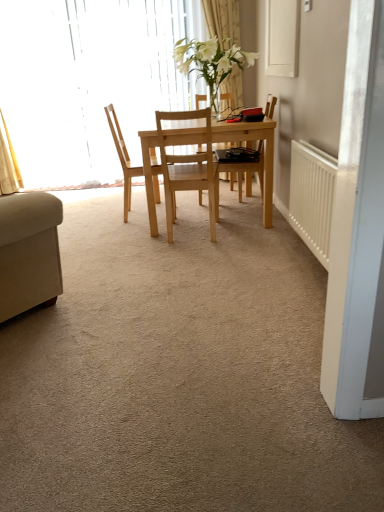
Where is `vacant area that lies in front of light wood table at center`? This screenshot has width=384, height=512. vacant area that lies in front of light wood table at center is located at coordinates (181, 265).